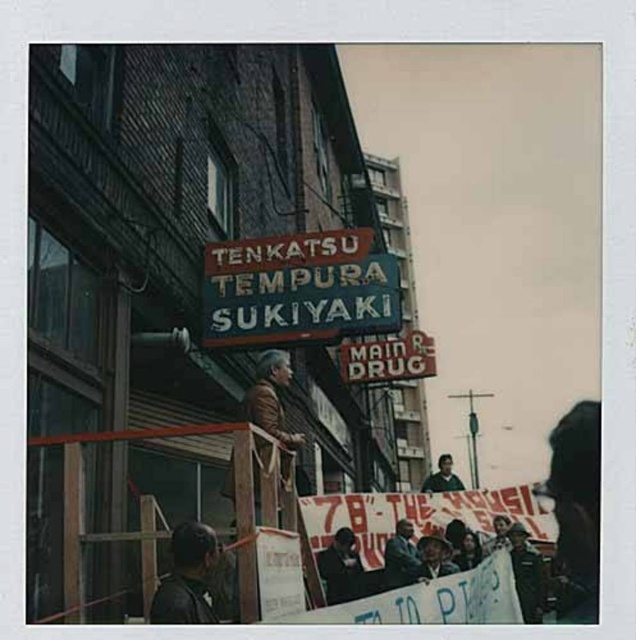
You are a fashion designer observing the street scene. You notice the dark brown leather jacket at lower left and the dark green uniform at center. Which clothing item is shorter in length?

The dark brown leather jacket at lower left is shorter than the dark green uniform at center.

You are standing on the street and want to take a photo of the large restaurant sign. There is a point at coordinates point [195,568] that is 21.95 meters away from you. Is this point closer to you than the restaurant sign?

The distance of point [195,568] from camera is 21.95 meters. However, the exact distance of the restaurant sign from the camera is not provided in the scene description, so we cannot determine if the point is closer to you than the restaurant sign.